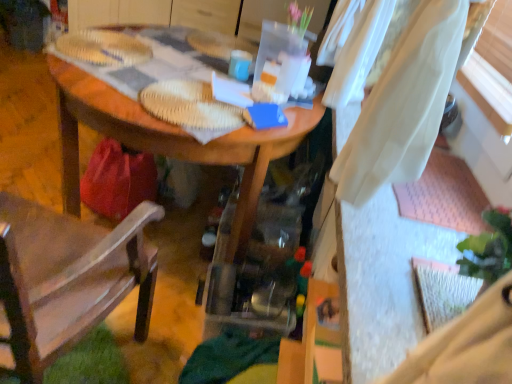
The height and width of the screenshot is (384, 512). In order to click on wooden desk at center in this screenshot , I will do `click(168, 140)`.

Describe the element at coordinates (240, 65) in the screenshot. I see `matte blue mug at center` at that location.

What is the approximate width of matte blue mug at center?

The width of matte blue mug at center is 3.88 inches.

This screenshot has height=384, width=512. Identify the location of brown fabric chair at left. (66, 280).

In order to click on chair below the wooden desk at center (from the image's perspective) in this screenshot , I will do `click(66, 280)`.

Looking at this image, from the image's perspective, is wooden desk at center on top of brown fabric chair at left?

Yes, from the image's perspective, wooden desk at center is above brown fabric chair at left.

Is wooden desk at center oriented towards brown fabric chair at left?

No, wooden desk at center is not aimed at brown fabric chair at left.

Consider the image. Between brown fabric chair at left and wooden desk at center, which one appears on the left side from the viewer's perspective?

Positioned to the left is brown fabric chair at left.

Are brown fabric chair at left and wooden desk at center located far from each other?

No, brown fabric chair at left is not far from wooden desk at center.

Is wooden desk at center inside brown fabric chair at left?

No, wooden desk at center is not inside brown fabric chair at left.

Does brown fabric chair at left lie in front of wooden desk at center?

Yes, brown fabric chair at left is closer to the camera.

Is point (237, 62) positioned in front of point (173, 53)?

That is True.

Identify the location of desk lying in front of the matte blue mug at center. The image size is (512, 384). (168, 140).

Based on the photo, from a real-world perspective, does matte blue mug at center stand above wooden desk at center?

Indeed, from a real-world perspective, matte blue mug at center stands above wooden desk at center.

Is wooden desk at center taller or shorter than matte blue mug at center?

In the image, wooden desk at center appears to be taller than matte blue mug at center.

Who is bigger, wooden desk at center or matte blue mug at center?

Bigger between the two is wooden desk at center.

From the picture: Is matte blue mug at center at the back of wooden desk at center?

No, matte blue mug at center is not at the back of wooden desk at center.

Would you consider wooden desk at center to be distant from matte blue mug at center?

No.

Which object is further away from the camera, brown fabric chair at left or matte blue mug at center?

matte blue mug at center is further away from the camera.

Who is shorter, brown fabric chair at left or matte blue mug at center?

With less height is matte blue mug at center.

Which of these two, brown fabric chair at left or matte blue mug at center, is thinner?

matte blue mug at center.

Does brown fabric chair at left have a smaller size compared to matte blue mug at center?

No, brown fabric chair at left is not smaller than matte blue mug at center.

Between matte blue mug at center and brown fabric chair at left, which one is positioned behind?

matte blue mug at center is behind.

Is matte blue mug at center placed right next to brown fabric chair at left?

No, matte blue mug at center is not next to brown fabric chair at left.

Does matte blue mug at center have a lesser width compared to brown fabric chair at left?

Yes, matte blue mug at center is thinner than brown fabric chair at left.

Considering the sizes of objects matte blue mug at center and brown fabric chair at left in the image provided, who is smaller, matte blue mug at center or brown fabric chair at left?

matte blue mug at center.

This screenshot has height=384, width=512. I want to click on chair located above the wooden desk at center (from a real-world perspective), so click(66, 280).

You are a GUI agent. You are given a task and a screenshot of the screen. Output one action in this format:
    pyautogui.click(x=<x>, y=<y>)
    Task: Click on the desk beneath the brown fabric chair at left (from a real-world perspective)
    
    Given the screenshot: What is the action you would take?
    pyautogui.click(x=168, y=140)

Estimate the real-world distances between objects in this image. Which object is closer to brown fabric chair at left, wooden desk at center or matte blue mug at center?

Based on the image, wooden desk at center appears to be nearer to brown fabric chair at left.

Estimate the real-world distances between objects in this image. Which object is closer to wooden desk at center, brown fabric chair at left or matte blue mug at center?

matte blue mug at center is positioned closer to the anchor wooden desk at center.

Estimate the real-world distances between objects in this image. Which object is further from matte blue mug at center, wooden desk at center or brown fabric chair at left?

The object further to matte blue mug at center is brown fabric chair at left.

Based on their spatial positions, is brown fabric chair at left or wooden desk at center closer to matte blue mug at center?

The object closer to matte blue mug at center is wooden desk at center.

In the scene shown: Considering their positions, is matte blue mug at center positioned closer to wooden desk at center than brown fabric chair at left?

Based on the image, matte blue mug at center appears to be nearer to wooden desk at center.

Considering their positions, is matte blue mug at center positioned closer to brown fabric chair at left than wooden desk at center?

wooden desk at center lies closer to brown fabric chair at left than the other object.

The width and height of the screenshot is (512, 384). In order to click on desk between brown fabric chair at left and matte blue mug at center in the front-back direction in this screenshot , I will do `click(168, 140)`.